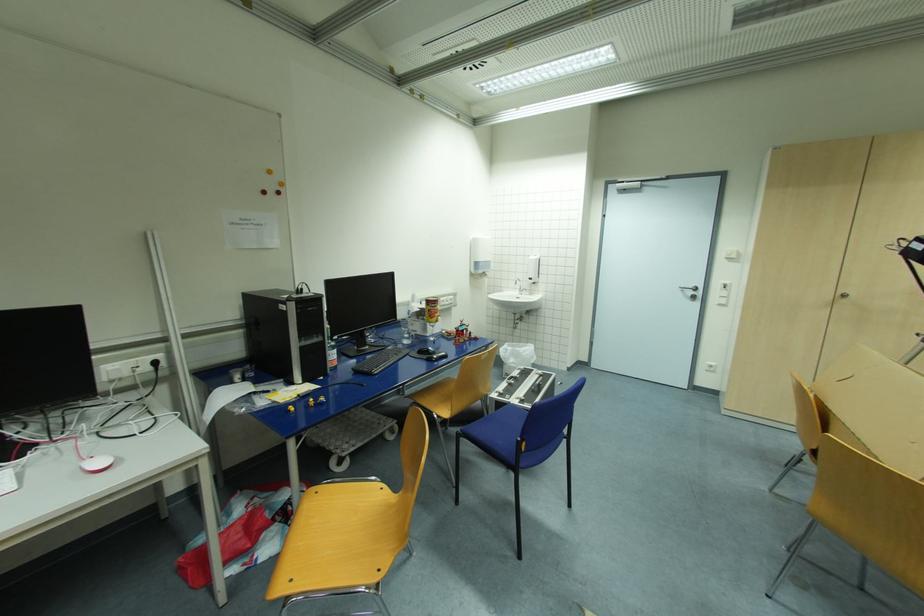
What are the coordinates of `metal door handle` in the screenshot? It's located at point(689,288).